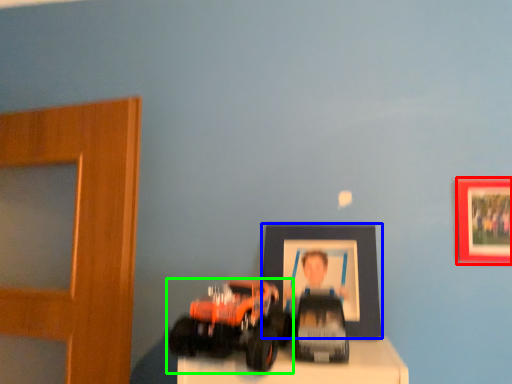
Question: Which object is the closest to the picture frame (highlighted by a red box)? Choose among these: picture frame (highlighted by a blue box) or toy (highlighted by a green box).

Choices:
 (A) picture frame
 (B) toy

Answer: (A)